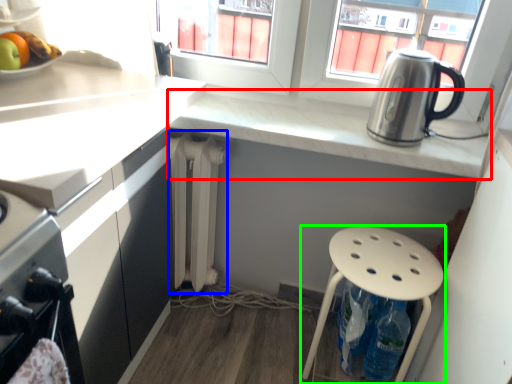
Question: Estimate the real-world distances between objects in this image. Which object is farther from countertop (highlighted by a red box), radiator (highlighted by a blue box) or stool (highlighted by a green box)?

Choices:
 (A) radiator
 (B) stool

Answer: (B)